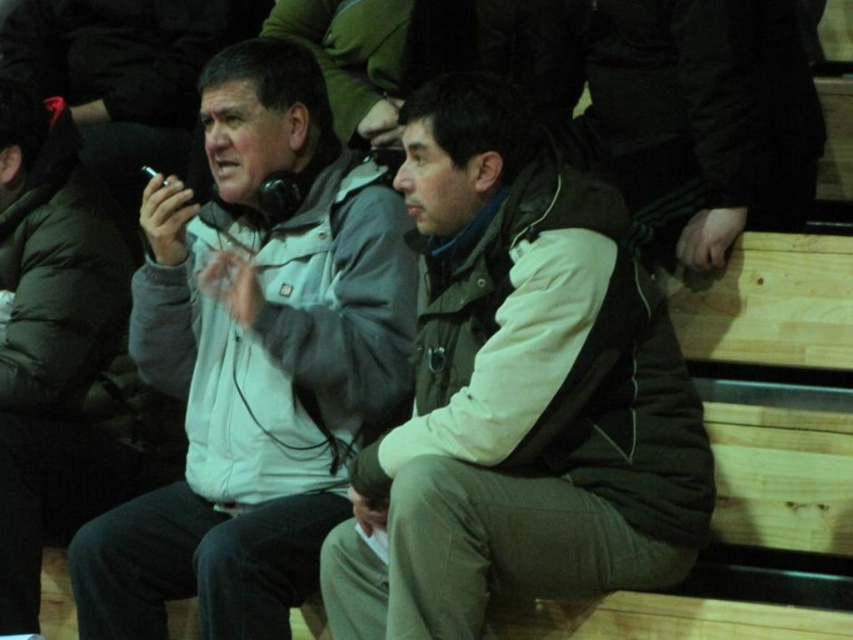
You are sitting on the bleachers and want to hand a note to the person wearing the matte brown jacket at center without disturbing the person in the gray matte jacket at center. How can you do this?

Since the matte brown jacket at center is closer to you than the gray matte jacket at center, you can reach the matte brown jacket at center first by extending your arm between them without disturbing the gray matte jacket at center.

You are a photographer standing at the camera position. You want to take a closeup shot of the gray matte jacket at center. What is the minimum distance you need to move forward to get the jacket into focus if your camera requires the subject to be at least 1.5 meters away?

The gray matte jacket at center is currently 2.08 meters away from the camera. Since the camera requires the subject to be at least 1.5 meters away, you can move forward 0.58 meters closer to reduce the distance to 1.5 meters, which meets the camera requirement.